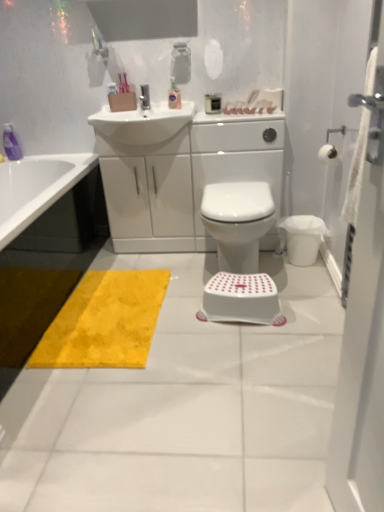
Locate an element on the screen. The width and height of the screenshot is (384, 512). vacant space that is to the left of white plastic bidet at center is located at coordinates (179, 275).